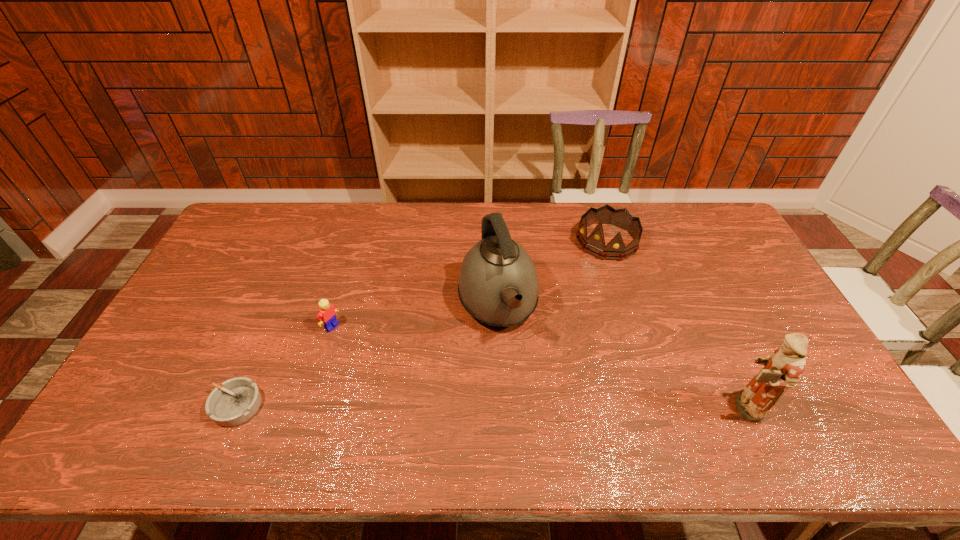
At what (x,y) coordinates should I click in order to perform the action: click on the shortest object. Please return your answer as a coordinate pair (x, y). The image size is (960, 540). Looking at the image, I should click on (234, 403).

This screenshot has height=540, width=960. Identify the location of ashtray. (234, 403).

Image resolution: width=960 pixels, height=540 pixels. Identify the location of figurine. (782, 370).

I want to click on the third object from right to left, so click(498, 285).

This screenshot has height=540, width=960. I want to click on the fourth object from right to left, so click(x=327, y=313).

This screenshot has height=540, width=960. I want to click on Lego, so click(x=327, y=313).

Locate an element on the screen. tiara is located at coordinates (595, 243).

Locate an element on the screen. the second object from right to left is located at coordinates (595, 243).

You are a GUI agent. You are given a task and a screenshot of the screen. Output one action in this format:
    pyautogui.click(x=<x>, y=<y>)
    Task: Click on the vacant area situated on the back of the ashtray
    
    Given the screenshot: What is the action you would take?
    pyautogui.click(x=283, y=295)

Image resolution: width=960 pixels, height=540 pixels. What are the coordinates of `vacant space located on the front-facing side of the rightmost object` in the screenshot? It's located at (653, 407).